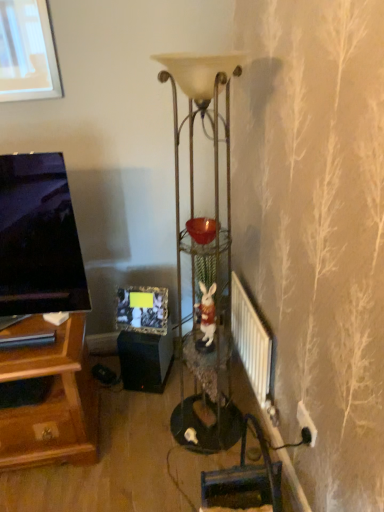
At what (x,y) coordinates should I click in order to perform the action: click on vacant space situated on the left part of metallic gold floor lamp at center. Please return your answer as a coordinate pair (x, y). The image size is (384, 512). Looking at the image, I should click on (135, 433).